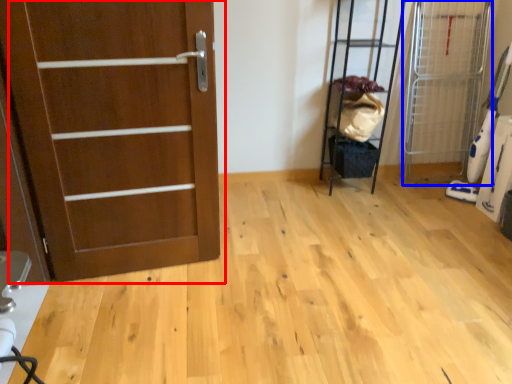
Question: Which of the following is the closest to the observer, door (highlighted by a red box) or elevator (highlighted by a blue box)?

Choices:
 (A) door
 (B) elevator

Answer: (A)